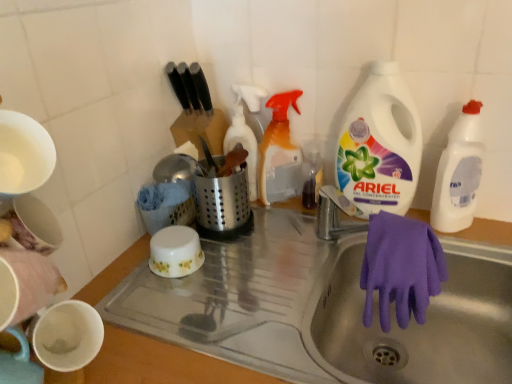
Where is `vacant space in front of white plastic bottle at upper right, which is counted as the 1th cleaning product, starting from the right`? The width and height of the screenshot is (512, 384). vacant space in front of white plastic bottle at upper right, which is counted as the 1th cleaning product, starting from the right is located at coordinates (472, 252).